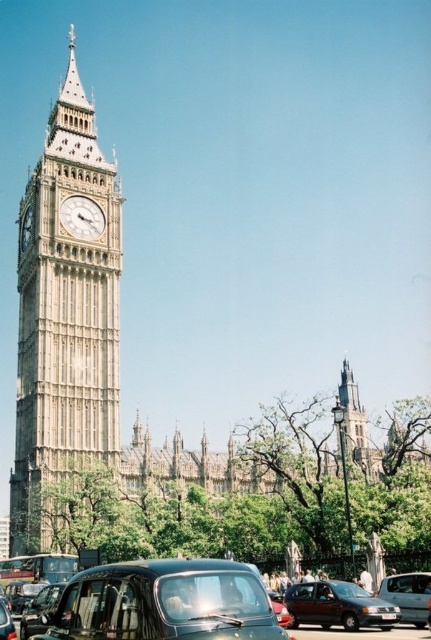
In the scene shown: Which of these two, stone clock tower at left or black rubber car at lower center, stands shorter?

black rubber car at lower center is shorter.

Is stone clock tower at left bigger than black rubber car at lower center?

Correct, stone clock tower at left is larger in size than black rubber car at lower center.

Does point (74, 467) come closer to viewer compared to point (380, 552)?

Yes, it is.

Where is `stone clock tower at left`? stone clock tower at left is located at coordinates (65, 317).

Between stone clock tower at left and metallic silver car at lower right, which one has more height?

Standing taller between the two is stone clock tower at left.

Which of these two, stone clock tower at left or metallic silver car at lower right, stands shorter?

metallic silver car at lower right

Is point (65, 141) positioned before point (390, 589)?

No, (65, 141) is further to viewer.

Identify the location of stone clock tower at left. (65, 317).

Is point (71, 291) farther from viewer compared to point (91, 212)?

No, (71, 291) is in front of (91, 212).

Between point (56, 420) and point (87, 205), which one is positioned behind?

Positioned behind is point (87, 205).

Is point (103, 186) farther from camera compared to point (87, 205)?

Yes, it is.

You are a GUI agent. You are given a task and a screenshot of the screen. Output one action in this format:
    pyautogui.click(x=<x>, y=<y>)
    Task: Click on the stone clock tower at left
    This screenshot has width=431, height=640.
    Given the screenshot: What is the action you would take?
    pyautogui.click(x=65, y=317)